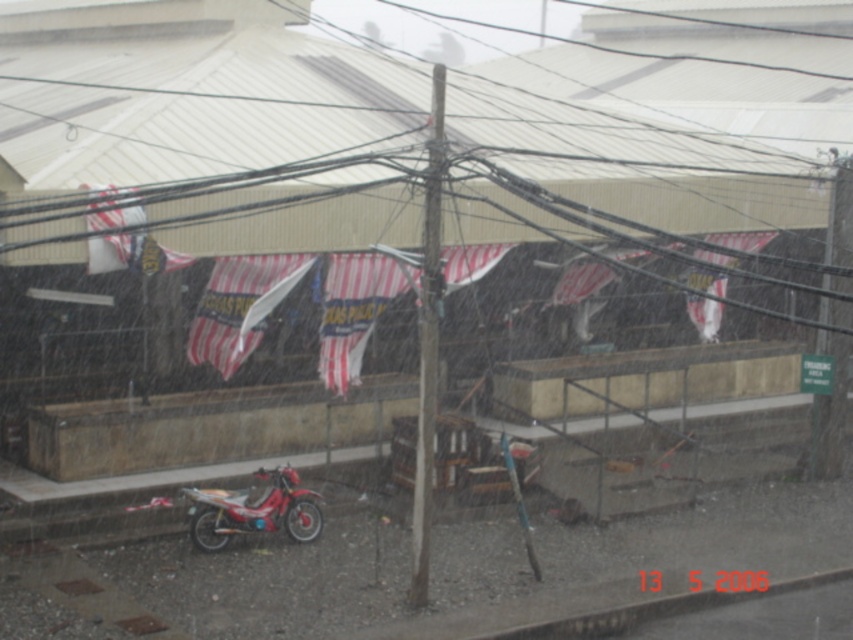
Between smooth wooden pole at center and shiny red motorcycle at lower left, which one is positioned higher?

Positioned higher is smooth wooden pole at center.

Is point (427, 358) more distant than point (296, 477)?

No, it is in front of (296, 477).

Locate an element on the screen. This screenshot has height=640, width=853. smooth wooden pole at center is located at coordinates (428, 340).